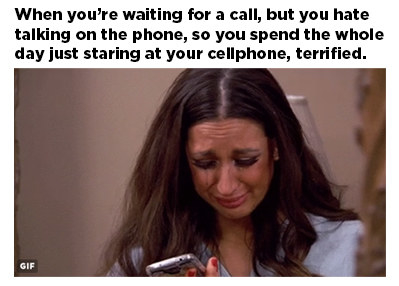
What are the coordinates of `tan wall` in the screenshot? It's located at (96, 166).